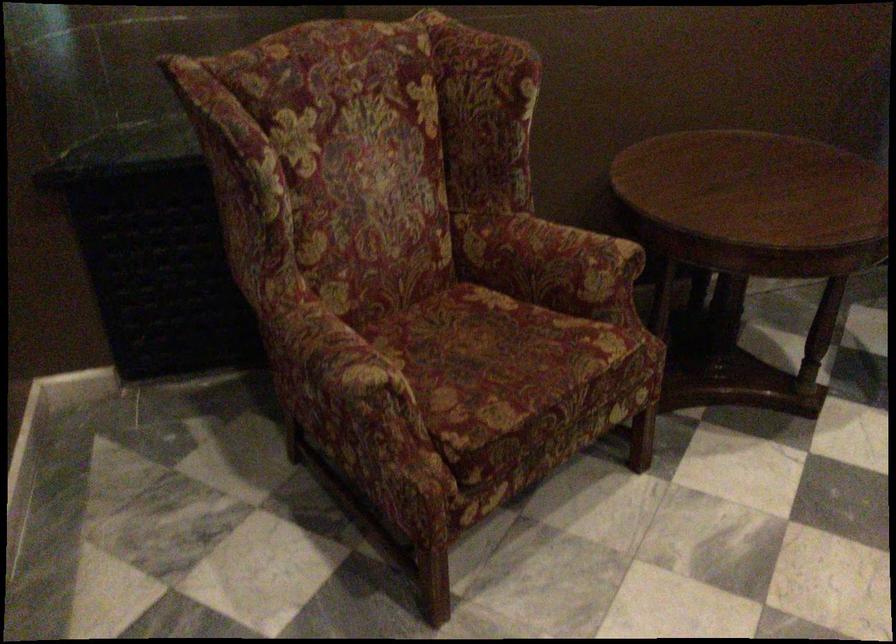
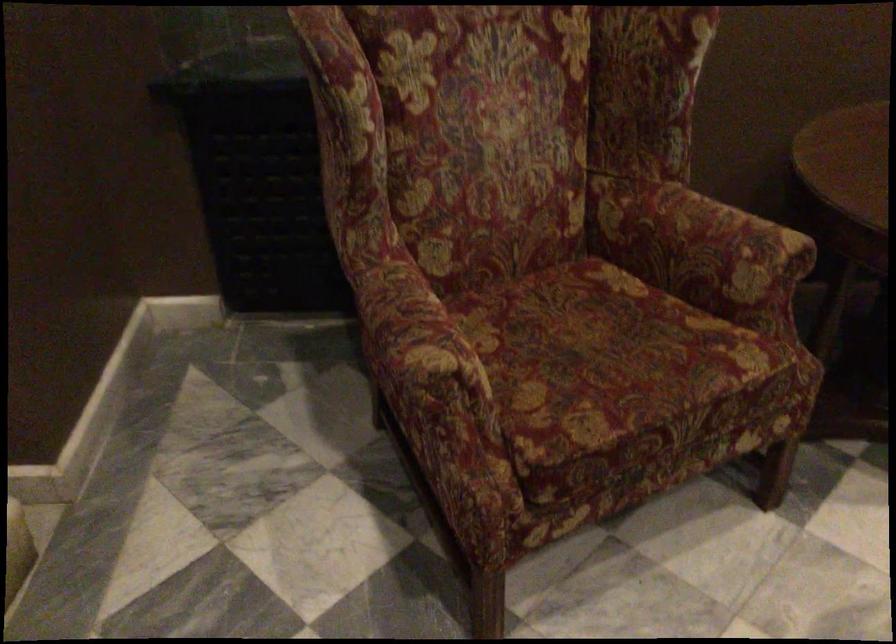
Where in the second image is the point corresponding to pixel 556 257 from the first image?

(700, 243)